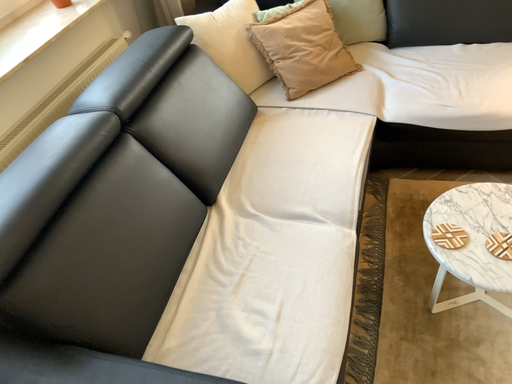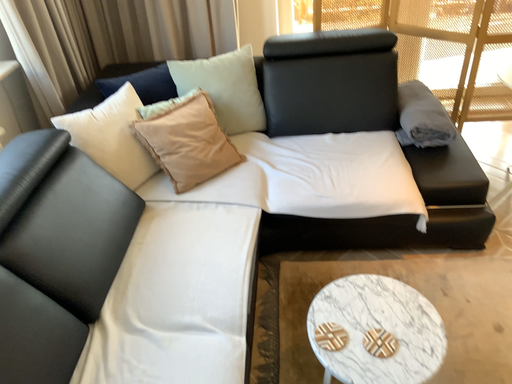
Question: Which way did the camera rotate in the video?

Choices:
 (A) rotated upward
 (B) rotated downward

Answer: (A)